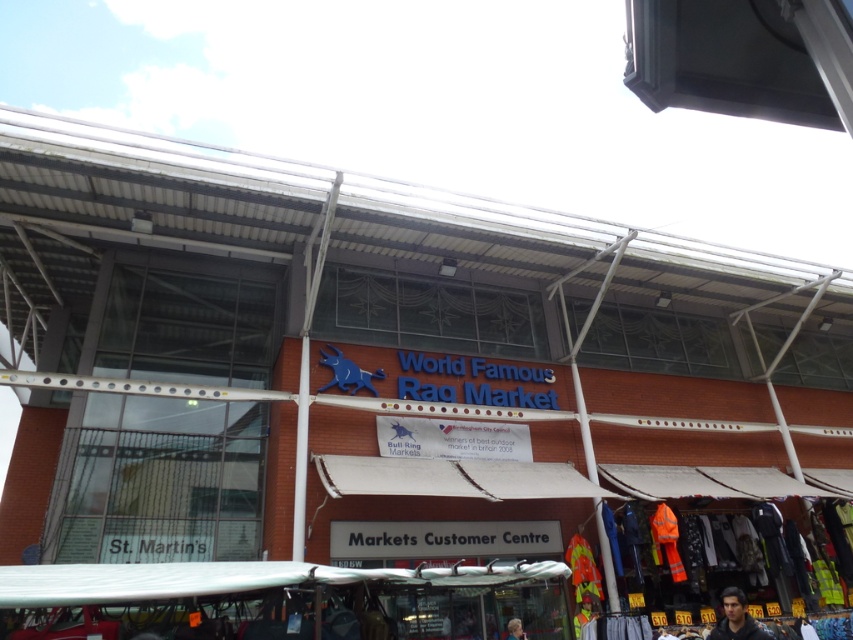
Does dark blue jacket at lower right lie in front of smooth skin face at lower center?

Yes, dark blue jacket at lower right is in front of smooth skin face at lower center.

Which of these two, dark blue jacket at lower right or smooth skin face at lower center, stands taller?

dark blue jacket at lower right is taller.

Which is in front, point (730, 637) or point (509, 625)?

Point (730, 637) is more forward.

At what (x,y) coordinates should I click in order to perform the action: click on dark blue jacket at lower right. Please return your answer as a coordinate pair (x, y). The height and width of the screenshot is (640, 853). Looking at the image, I should click on (735, 618).